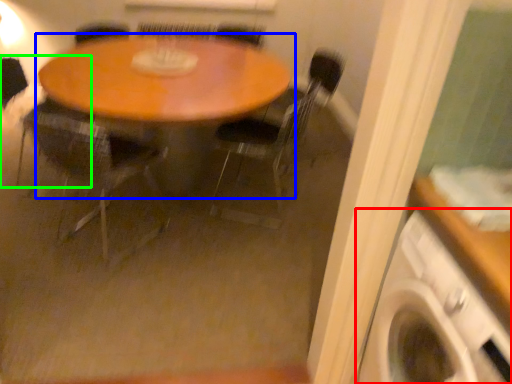
Question: Which is farther away from washing machine (highlighted by a red box)? table (highlighted by a blue box) or armchair (highlighted by a green box)?

Choices:
 (A) table
 (B) armchair

Answer: (B)